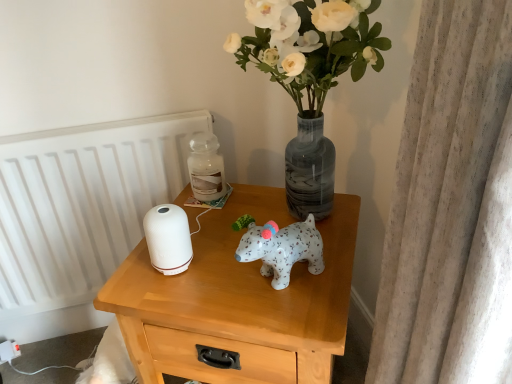
Locate an element on the screen. vacant space underneath white matte vase at upper center (from a real-world perspective) is located at coordinates (287, 218).